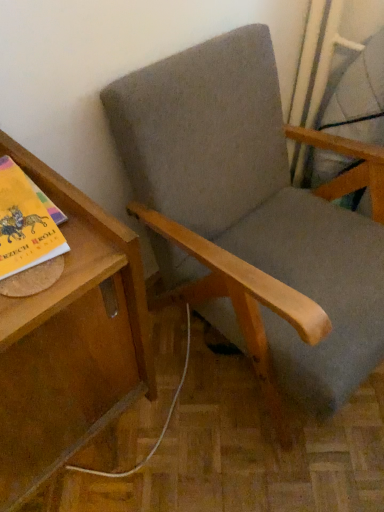
Question: Would you say wooden table at left is inside or outside textured gray fabric chair at center?

Choices:
 (A) outside
 (B) inside

Answer: (A)

Question: Is wooden table at left wider or thinner than textured gray fabric chair at center?

Choices:
 (A) wide
 (B) thin

Answer: (B)

Question: Based on their relative distances, which object is farther from the wooden table at left?

Choices:
 (A) textured gray fabric chair at center
 (B) matte gray swivel chair at upper right

Answer: (B)

Question: Which object is the farthest from the wooden table at left?

Choices:
 (A) matte gray swivel chair at upper right
 (B) textured gray fabric chair at center

Answer: (A)